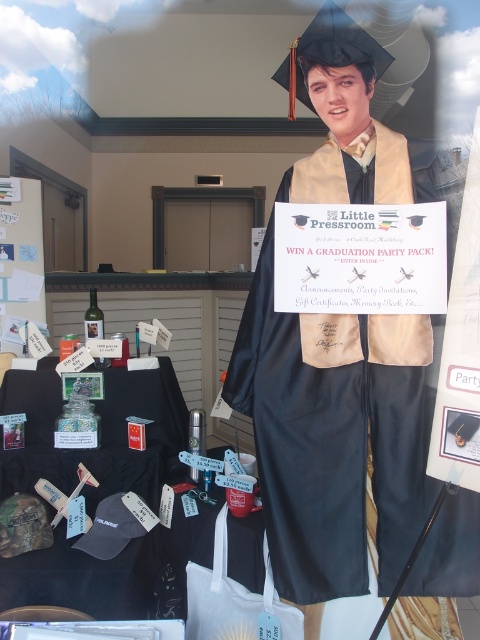
Who is taller, gold satin graduation gown at center or black fabric table at lower left?

gold satin graduation gown at center is taller.

Who is more distant from viewer, (284,396) or (148,394)?

The point (148,394) is behind.

Does point (291, 392) lie behind point (182, 426)?

No, (291, 392) is in front of (182, 426).

Where is `gold satin graduation gown at center`? Image resolution: width=480 pixels, height=640 pixels. gold satin graduation gown at center is located at coordinates (334, 440).